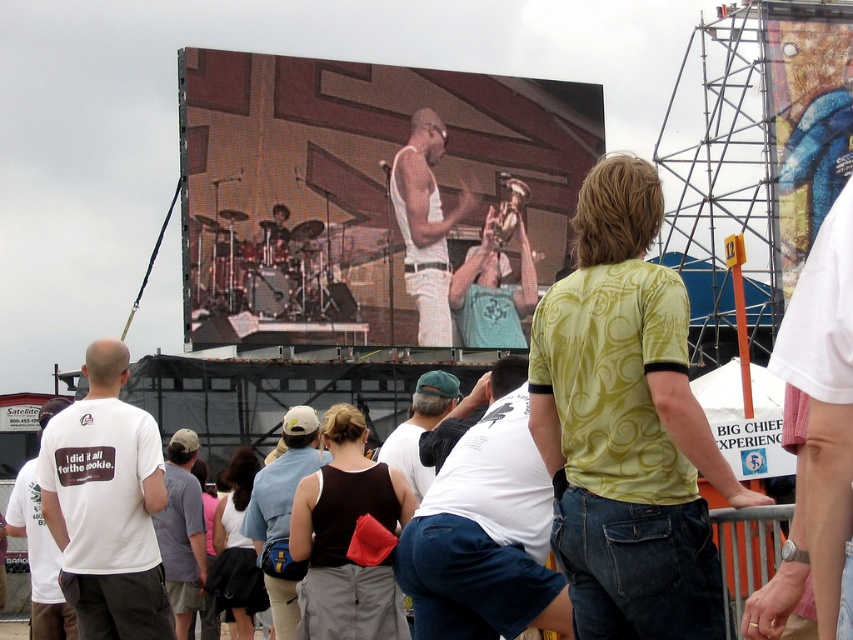
Is green printed t-shirt at center shorter than gray fabric shirt at lower left?

No, green printed t-shirt at center is not shorter than gray fabric shirt at lower left.

Is green printed t-shirt at center to the left of gray fabric shirt at lower left from the viewer's perspective?

No, green printed t-shirt at center is not to the left of gray fabric shirt at lower left.

Which is behind, point (645, 195) or point (184, 614)?

The point (184, 614) is behind.

Find the location of a particular element. This screenshot has width=853, height=640. green printed t-shirt at center is located at coordinates (625, 426).

Does white matte t-shirt at center have a greater height compared to gray fabric shirt at lower left?

Indeed, white matte t-shirt at center has a greater height compared to gray fabric shirt at lower left.

From the picture: Is white matte t-shirt at center smaller than gray fabric shirt at lower left?

No, white matte t-shirt at center is not smaller than gray fabric shirt at lower left.

Between point (82, 368) and point (183, 563), which one is positioned in front?

Point (183, 563) is in front.

At what (x,y) coordinates should I click in order to perform the action: click on white matte t-shirt at center. Please return your answer as a coordinate pair (x, y). The height and width of the screenshot is (640, 853). Looking at the image, I should click on (107, 502).

Consider the image. Which of these two, white tank top at center or matte black tank top at center, stands taller?

Standing taller between the two is white tank top at center.

Which is behind, point (405, 266) or point (218, 593)?

The point (405, 266) is more distant.

Is point (413, 292) in front of point (227, 476)?

No, (413, 292) is further to viewer.

Find the location of `white tank top at center`. white tank top at center is located at coordinates (426, 225).